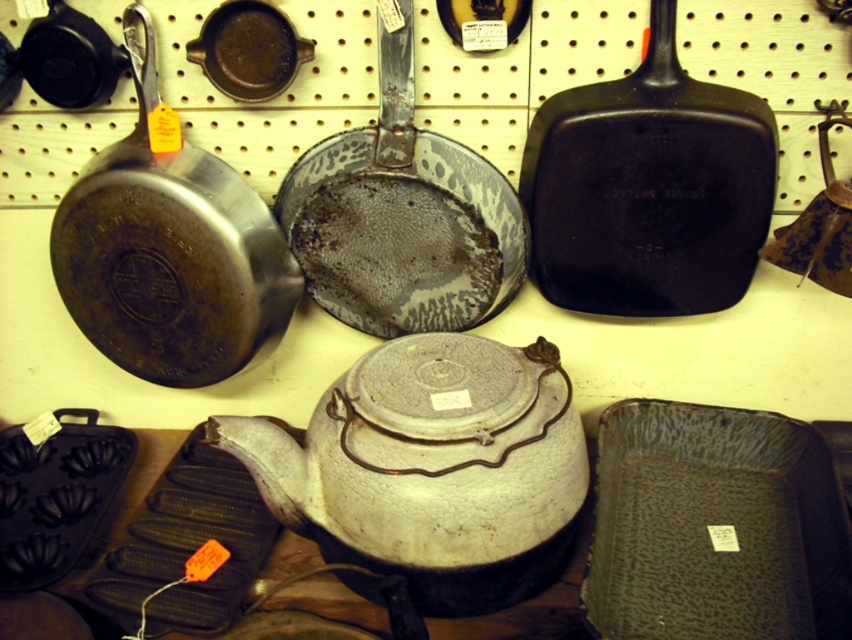
Is white matte teapot at center smaller than matte cast iron skillet at upper center?

Incorrect, white matte teapot at center is not smaller in size than matte cast iron skillet at upper center.

Who is higher up, white matte teapot at center or matte cast iron skillet at upper center?

matte cast iron skillet at upper center

Find the location of a particular element. white matte teapot at center is located at coordinates point(432,467).

Where is `white matte teapot at center`? The image size is (852, 640). white matte teapot at center is located at coordinates (432, 467).

Which is behind, point (657, 90) or point (269, 8)?

Point (269, 8)

Is point (746, 92) behind point (216, 86)?

That is False.

Is point (639, 209) positioned in front of point (249, 70)?

Yes, point (639, 209) is in front of point (249, 70).

Where is `matte black frying pan at upper right`? The height and width of the screenshot is (640, 852). matte black frying pan at upper right is located at coordinates (648, 188).

Is white matte teapot at center thinner than matte black frying pan at upper right?

Incorrect, white matte teapot at center's width is not less than matte black frying pan at upper right's.

Is point (465, 556) positioned behind point (642, 184)?

No, it is in front of (642, 184).

Find the location of `white matte teapot at center`. white matte teapot at center is located at coordinates (432, 467).